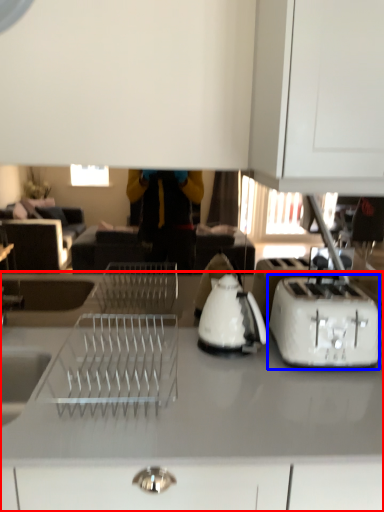
Question: Which point is further to the camera, countertop (highlighted by a red box) or toaster (highlighted by a blue box)?

Choices:
 (A) countertop
 (B) toaster

Answer: (B)